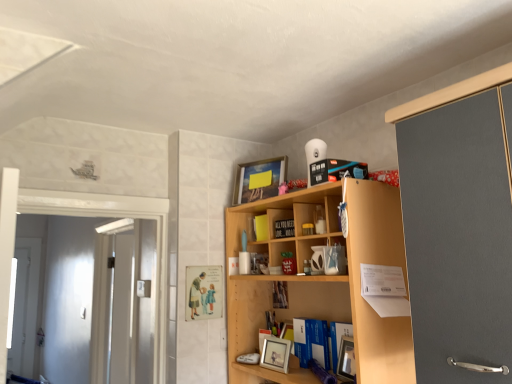
Question: Considering their positions, is yellow matte book at upper center, marked as the 2th book in a bottom-to-top arrangement, located in front of or behind matte silver picture frame at center, the 2th picture frame from the back?

Choices:
 (A) behind
 (B) front

Answer: (A)

Question: Is yellow matte book at upper center, which is counted as the second book, starting from the top, inside the boundaries of matte silver picture frame at center, the 2th picture frame from the back, or outside?

Choices:
 (A) inside
 (B) outside

Answer: (B)

Question: Which is nearer to the matte silver picture frame at center, the 2th picture frame from the back?

Choices:
 (A) yellow matte book at upper center, marked as the 2th book in a bottom-to-top arrangement
 (B) white glossy door at left
 (C) matte wooden picture frame at upper center, which ranks as the second picture frame in front-to-back order
 (D) wooden shelf at center
 (E) matte black book at upper center, the 3th book when ordered from bottom to top

Answer: (D)

Question: Which is farther from the matte black book at upper center, arranged as the 1th book when viewed from the top?

Choices:
 (A) matte silver picture frame at center, the 1th picture frame positioned from the front
 (B) wooden shelf at center
 (C) yellow matte book at upper center, acting as the second book starting from the front
 (D) matte wooden picture frame at upper center, which appears as the second picture frame when ordered from the bottom
 (E) wooden photo frame at center, the first book in the back-to-front sequence

Answer: (A)